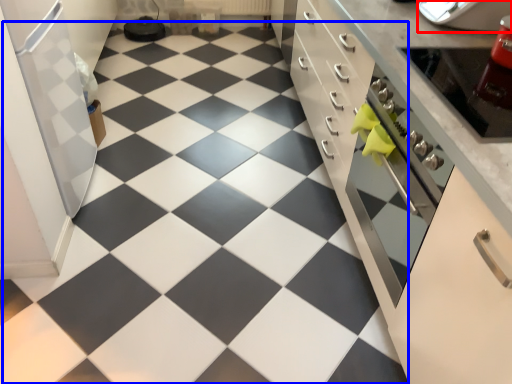
Question: Among these objects, which one is nearest to the camera, appliance (highlighted by a red box) or tile (highlighted by a blue box)?

Choices:
 (A) appliance
 (B) tile

Answer: (B)